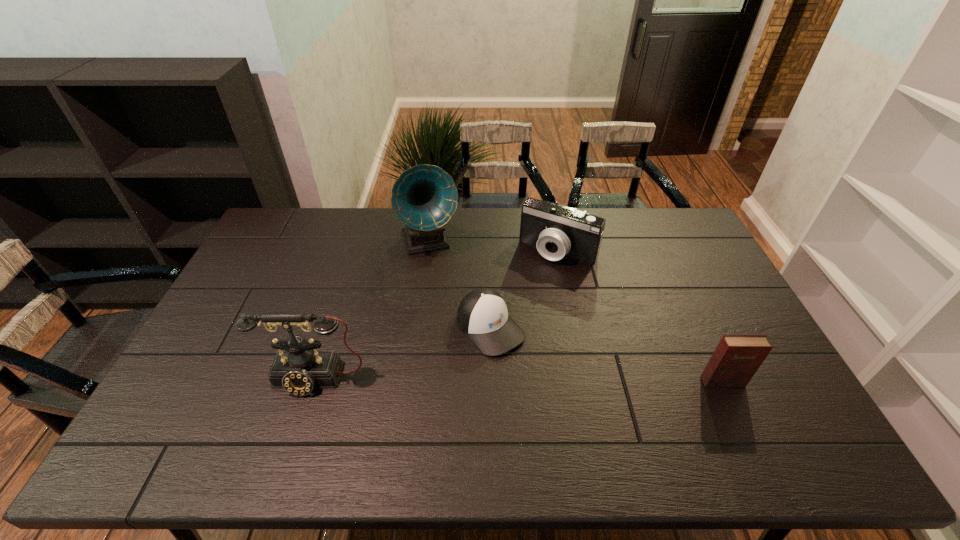
Where is `vacant space that's between the diary and the leftmost object`? The width and height of the screenshot is (960, 540). vacant space that's between the diary and the leftmost object is located at coordinates [x=518, y=380].

Where is `vacant area that lies between the phonograph_record and the fourth object from left to right`? vacant area that lies between the phonograph_record and the fourth object from left to right is located at coordinates (493, 247).

Identify the location of empty location between the fourth object from left to right and the fourth shortest object. (436, 315).

The width and height of the screenshot is (960, 540). In order to click on free spot between the fourth object from right to left and the rightmost object in this screenshot , I will do `click(576, 312)`.

This screenshot has height=540, width=960. What are the coordinates of `vacant point located between the diary and the telephone` in the screenshot? It's located at (518, 380).

Where is `vacant space that is in between the shortest object and the phonograph_record`? The width and height of the screenshot is (960, 540). vacant space that is in between the shortest object and the phonograph_record is located at coordinates [460, 285].

Locate an element on the screen. This screenshot has width=960, height=540. vacant area that lies between the second object from right to left and the phonograph_record is located at coordinates point(493,247).

Locate an element on the screen. object that stands as the fourth closest to the second object from right to left is located at coordinates (299, 369).

Identify which object is located as the nearest to the rightmost object. Please provide its 2D coordinates. Your answer should be formatted as a tuple, i.e. [(x, y)], where the tuple contains the x and y coordinates of a point satisfying the conditions above.

[(482, 315)]

Image resolution: width=960 pixels, height=540 pixels. What are the coordinates of `vacant space that satisfies the following two spatial constraints: 1. on the back side of the third farthest object; 2. on the right side of the fourth object from left to right` in the screenshot? It's located at (489, 251).